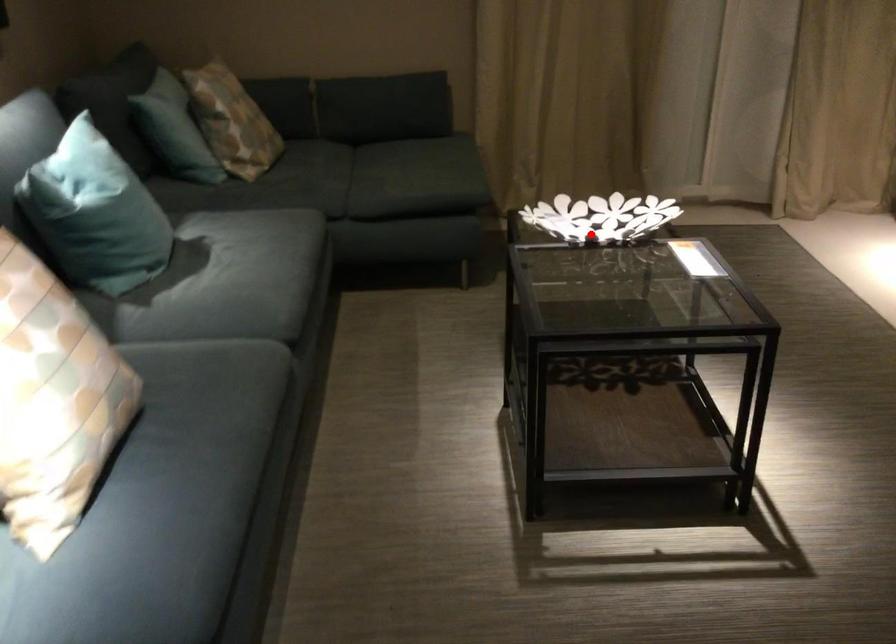
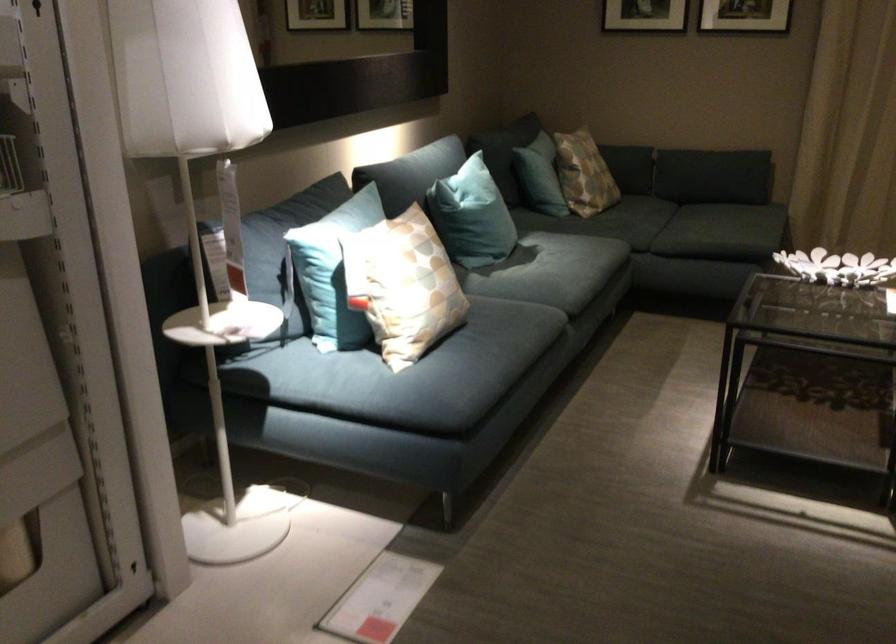
Question: I am providing you with two images of the same scene from different viewpoints. In image1, a red point is highlighted. Considering the same 3D point in image2, which of the following is correct?

Choices:
 (A) It is closer
 (B) It is farther

Answer: (B)